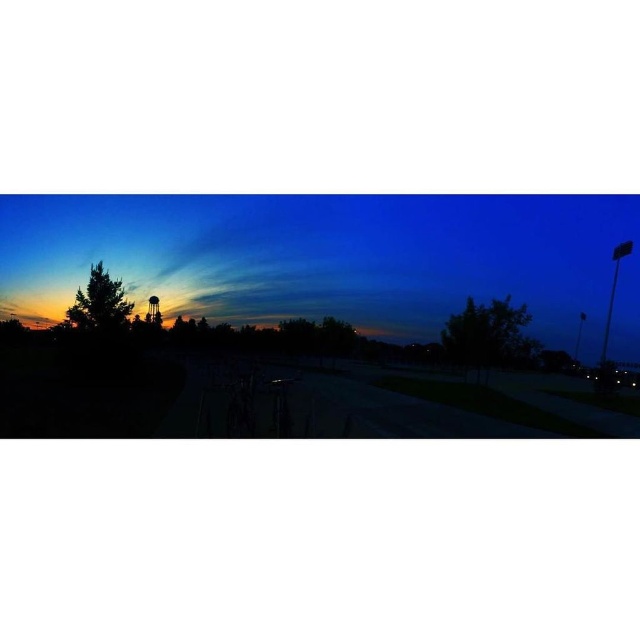
How far apart are silhouette trees at left and green leafy tree at center?

silhouette trees at left is 112.01 feet from green leafy tree at center.

From the picture: Can you confirm if silhouette trees at left is positioned above green leafy tree at center?

Indeed, silhouette trees at left is positioned over green leafy tree at center.

Which is behind, point (147, 227) or point (486, 364)?

Point (147, 227)

This screenshot has width=640, height=640. Find the location of `silhouette trees at left`. silhouette trees at left is located at coordinates (333, 260).

Does green leafy tree at center have a smaller size compared to green matte tree at left?

No.

Does point (502, 353) come closer to viewer compared to point (116, 324)?

Yes, it is in front of point (116, 324).

At what (x,y) coordinates should I click in order to perform the action: click on green leafy tree at center. Please return your answer as a coordinate pair (x, y). Looking at the image, I should click on (488, 333).

In the scene shown: Which is above, silhouette trees at left or green matte tree at left?

silhouette trees at left is above.

Between point (60, 260) and point (97, 298), which one is positioned behind?

Positioned behind is point (60, 260).

Is point (332, 272) positioned behind point (96, 301)?

Yes, it is.

Where is `silhouette trees at left`? Image resolution: width=640 pixels, height=640 pixels. silhouette trees at left is located at coordinates (333, 260).